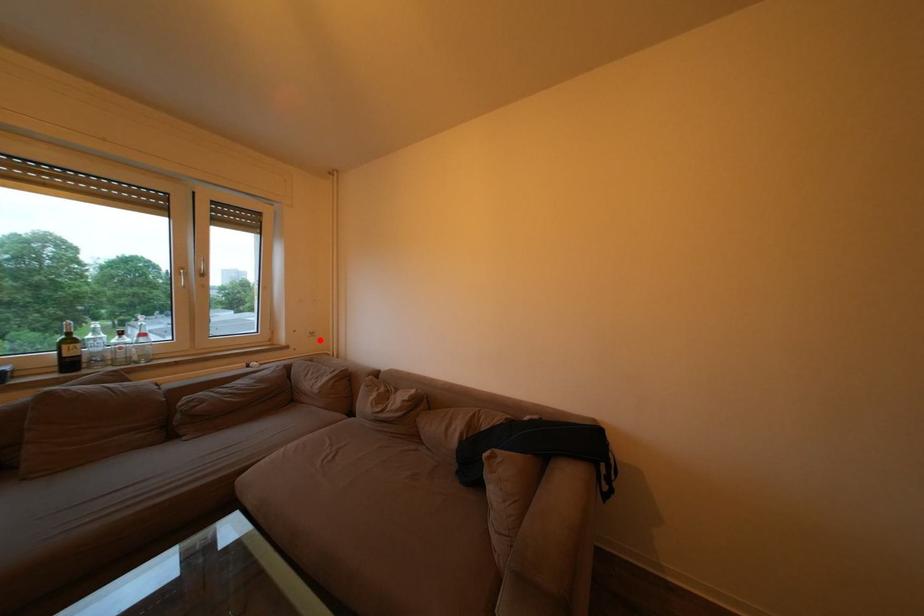
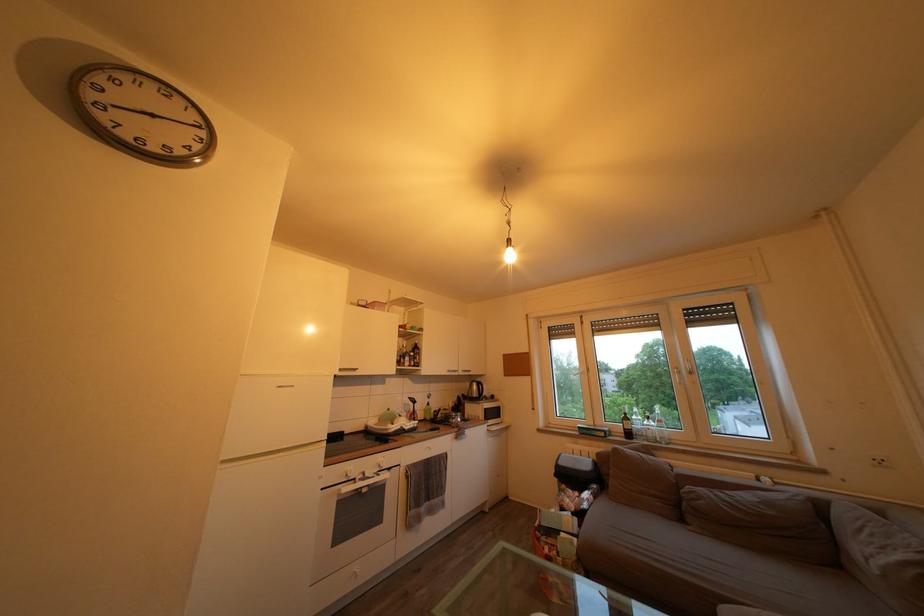
Where in the second image is the point corresponding to the highlighted location from the first image?

(889, 468)